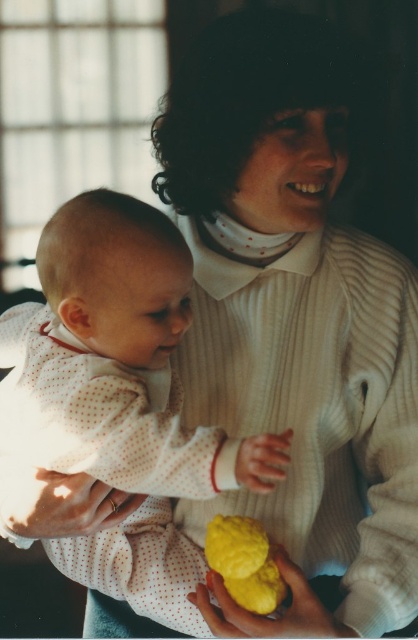
You are a parent holding a baby and two items in your hands. You have the white dotted fabric at center and the yellow matte cookie at lower center. The baby is looking at the yellow one. Which item should you give to the baby first based on their interest?

The baby is looking at the yellow matte cookie at lower center, so you should give them the yellow matte cookie at lower center first.

You are a photographer trying to capture a closeup of the yellow matte cookie at lower center without the white dotted fabric at center blocking the view. Can you adjust your position to do so?

The white dotted fabric at center is closer to the viewer than the yellow matte cookie at lower center, so moving your camera position slightly lower or adjusting the angle might help to avoid the obstruction.